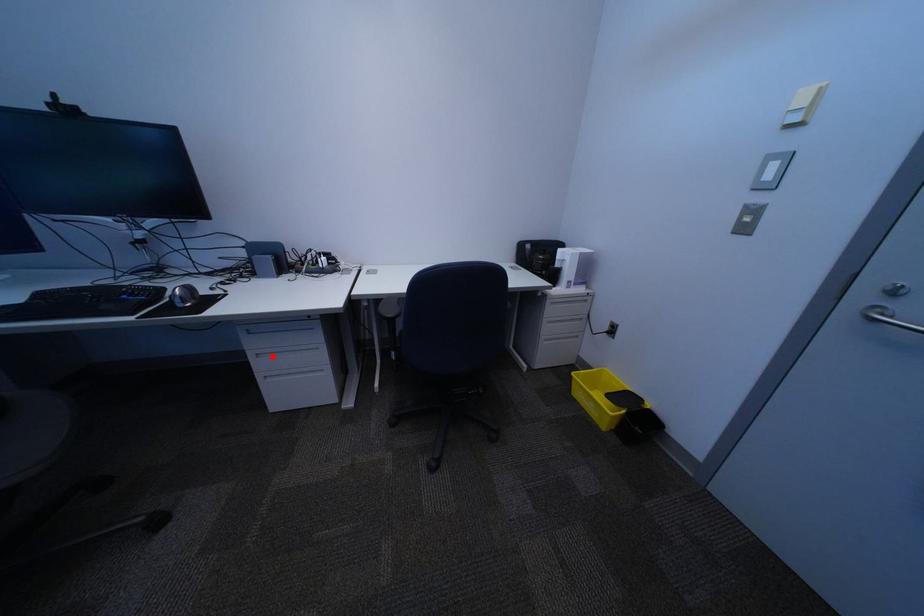
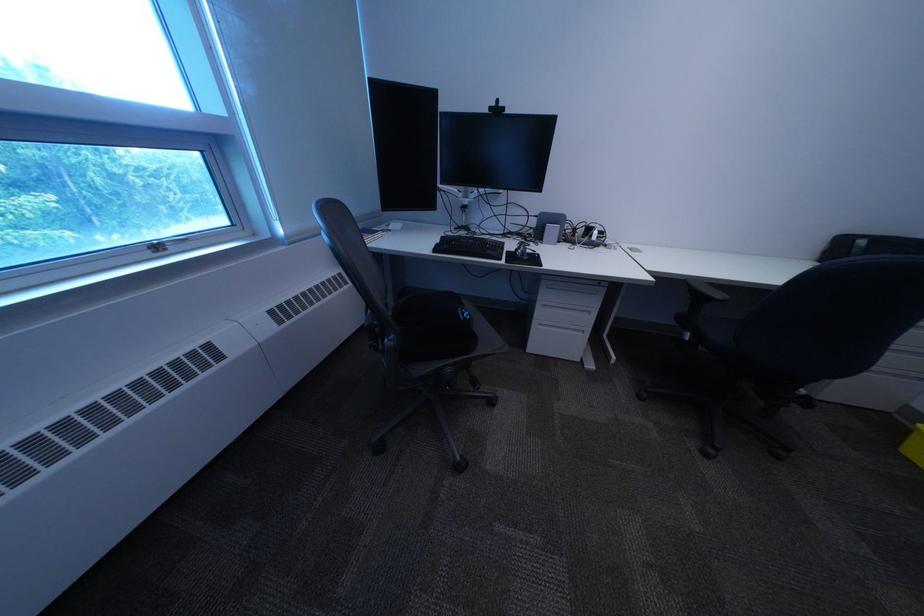
In the second image, find the point that corresponds to the highlighted location in the first image.

(558, 307)